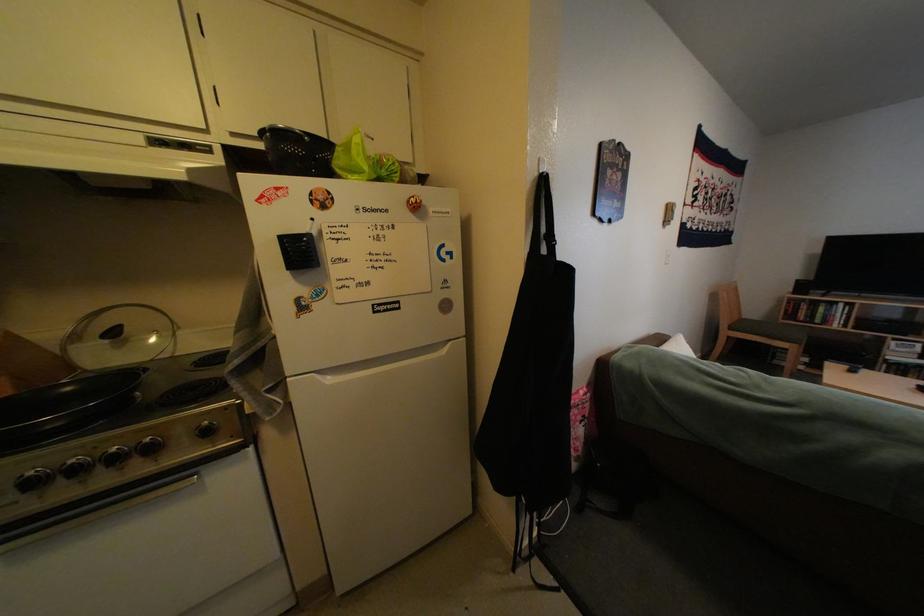
Identify the location of black magnetic holder. This screenshot has width=924, height=616. (550, 171).